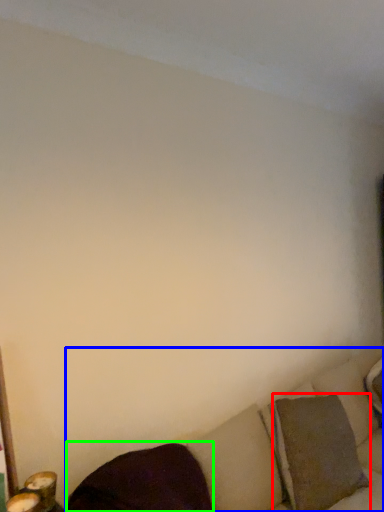
Question: Which object is positioned farthest from pillow (highlighted by a red box)? Select from studio couch (highlighted by a blue box) and pillow (highlighted by a green box).

Choices:
 (A) studio couch
 (B) pillow

Answer: (B)